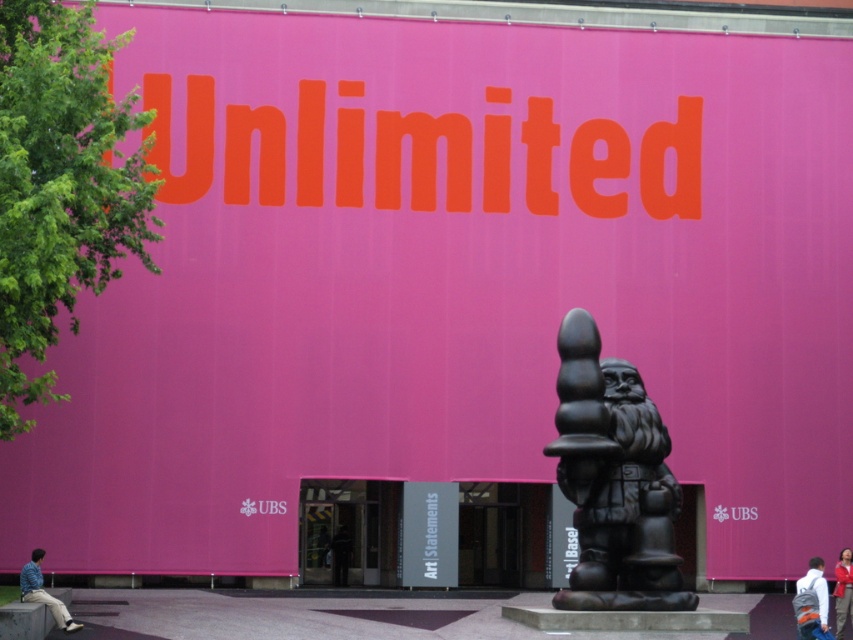
You are standing at the entrance of the building and want to take a photo of the black matte statue at center without including the pink wall with orange text. Which direction should you move to ensure the statue is in frame while avoiding the wall?

Move to the left of the black matte statue at center to avoid the pink wall with orange text in the background.

You are standing at the entrance of the building and want to walk towards the point labeled as point (846, 564). Which direction should you move relative to the point labeled point (799, 636)?

You should move towards the point labeled point (846, 564), which is behind the point labeled point (799, 636).

You are standing in front of the building and want to place a white fabric backpack at lower right. Where should you place it?

Place the white fabric backpack at lower right at the 2D coordinate point of (813, 602).